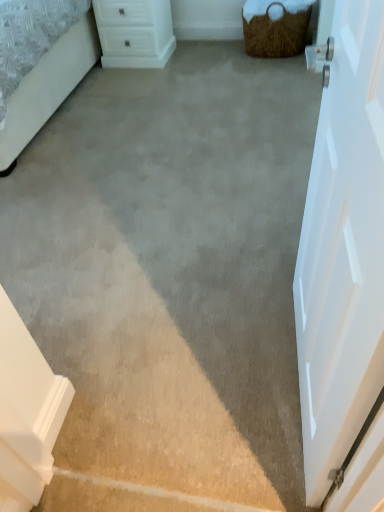
I want to click on white plastic chest of drawers at upper center, so click(135, 32).

The height and width of the screenshot is (512, 384). What are the coordinates of `brown woven basket at upper right` in the screenshot? It's located at (275, 27).

Image resolution: width=384 pixels, height=512 pixels. I want to click on white plastic chest of drawers at upper center, so click(x=135, y=32).

Is brown woven basket at upper right inside the boundaries of white plastic chest of drawers at upper center, or outside?

brown woven basket at upper right is outside white plastic chest of drawers at upper center.

From a real-world perspective, which is physically above, brown woven basket at upper right or white plastic chest of drawers at upper center?

white plastic chest of drawers at upper center.

Consider the image. Considering the sizes of objects brown woven basket at upper right and white plastic chest of drawers at upper center in the image provided, who is wider, brown woven basket at upper right or white plastic chest of drawers at upper center?

white plastic chest of drawers at upper center.

From the image's perspective, is brown woven basket at upper right on top of white plastic chest of drawers at upper center?

Result: No, from the image's perspective, brown woven basket at upper right is not above white plastic chest of drawers at upper center.

From their relative heights in the image, would you say white smooth door at right is taller or shorter than brown woven basket at upper right?

white smooth door at right is taller than brown woven basket at upper right.

Is white smooth door at right looking in the opposite direction of brown woven basket at upper right?

white smooth door at right does not have its back to brown woven basket at upper right.

Which is more to the left, white smooth door at right or brown woven basket at upper right?

Positioned to the left is white smooth door at right.

Does white smooth door at right contain brown woven basket at upper right?

No, brown woven basket at upper right is not a part of white smooth door at right.

From a real-world perspective, between white plastic chest of drawers at upper center and brown woven basket at upper right, who is vertically higher?

white plastic chest of drawers at upper center.

Is white plastic chest of drawers at upper center in front of or behind brown woven basket at upper right in the image?

Clearly, white plastic chest of drawers at upper center is behind brown woven basket at upper right.

Is white plastic chest of drawers at upper center surrounding brown woven basket at upper right?

No, brown woven basket at upper right is not surrounded by white plastic chest of drawers at upper center.

Considering the sizes of objects white plastic chest of drawers at upper center and brown woven basket at upper right in the image provided, who is taller, white plastic chest of drawers at upper center or brown woven basket at upper right?

Standing taller between the two is white plastic chest of drawers at upper center.

From a real-world perspective, who is located higher, white plastic chest of drawers at upper center or white smooth door at right?

white smooth door at right.

Who is bigger, white plastic chest of drawers at upper center or white smooth door at right?

With larger size is white plastic chest of drawers at upper center.

Are white plastic chest of drawers at upper center and white smooth door at right far apart?

white plastic chest of drawers at upper center is far away from white smooth door at right.

Does white plastic chest of drawers at upper center have a lesser width compared to white smooth door at right?

No.

Does brown woven basket at upper right have a smaller size compared to white smooth door at right?

No.

Considering the relative sizes of brown woven basket at upper right and white smooth door at right in the image provided, is brown woven basket at upper right thinner than white smooth door at right?

No.

From a real-world perspective, is brown woven basket at upper right positioned above or below white smooth door at right?

From a real-world perspective, brown woven basket at upper right is physically below white smooth door at right.

Is brown woven basket at upper right far from white smooth door at right?

brown woven basket at upper right is far away from white smooth door at right.

Are white smooth door at right and white plastic chest of drawers at upper center far apart?

That's right, there is a large distance between white smooth door at right and white plastic chest of drawers at upper center.

Considering the sizes of objects white smooth door at right and white plastic chest of drawers at upper center in the image provided, who is bigger, white smooth door at right or white plastic chest of drawers at upper center?

white plastic chest of drawers at upper center.

Is white smooth door at right positioned in front of white plastic chest of drawers at upper center?

That is True.

Locate an element on the screen. the chest of drawers that is above the white smooth door at right (from the image's perspective) is located at coordinates 135,32.

This screenshot has width=384, height=512. I want to click on basket on the right side of white plastic chest of drawers at upper center, so click(275, 27).

The width and height of the screenshot is (384, 512). I want to click on door on the left of brown woven basket at upper right, so (345, 271).

Based on the photo, looking at the image, which one is located further to white plastic chest of drawers at upper center, brown woven basket at upper right or white smooth door at right?

white smooth door at right.

When comparing their distances from white smooth door at right, does white plastic chest of drawers at upper center or brown woven basket at upper right seem further?

white plastic chest of drawers at upper center.

From the image, which object appears to be nearer to white plastic chest of drawers at upper center, white smooth door at right or brown woven basket at upper right?

brown woven basket at upper right.

Estimate the real-world distances between objects in this image. Which object is closer to white smooth door at right, brown woven basket at upper right or white plastic chest of drawers at upper center?

The object closer to white smooth door at right is brown woven basket at upper right.

Looking at this image, estimate the real-world distances between objects in this image. Which object is further from brown woven basket at upper right, white smooth door at right or white plastic chest of drawers at upper center?

white smooth door at right lies further to brown woven basket at upper right than the other object.

Looking at the image, which one is located further to brown woven basket at upper right, white plastic chest of drawers at upper center or white smooth door at right?

The object further to brown woven basket at upper right is white smooth door at right.

I want to click on basket positioned between white smooth door at right and white plastic chest of drawers at upper center from near to far, so click(x=275, y=27).